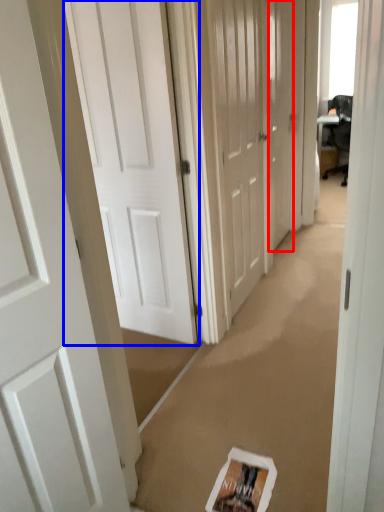
Question: Which object appears closest to the camera in this image, door (highlighted by a red box) or door (highlighted by a blue box)?

Choices:
 (A) door
 (B) door

Answer: (B)